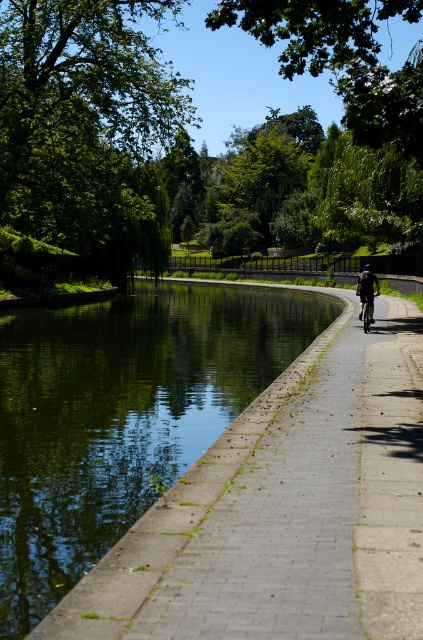
Question: Which point is farther from the camera taking this photo?

Choices:
 (A) (360, 310)
 (B) (277, 340)
 (C) (368, 300)

Answer: (B)

Question: Can you confirm if green concrete river at center is positioned above shiny silver bicycle at center?

Choices:
 (A) yes
 (B) no

Answer: (B)

Question: Is dark blue fabric jacket at center-right above shiny silver bicycle at center?

Choices:
 (A) yes
 (B) no

Answer: (A)

Question: Is green concrete river at center wider than dark blue fabric jacket at center-right?

Choices:
 (A) yes
 (B) no

Answer: (A)

Question: Which point appears farthest from the camera in this image?

Choices:
 (A) 362,305
 (B) 153,394
 (C) 359,300

Answer: (C)

Question: Estimate the real-world distances between objects in this image. Which object is closer to the green concrete river at center?

Choices:
 (A) shiny silver bicycle at center
 (B) dark blue fabric jacket at center-right

Answer: (B)